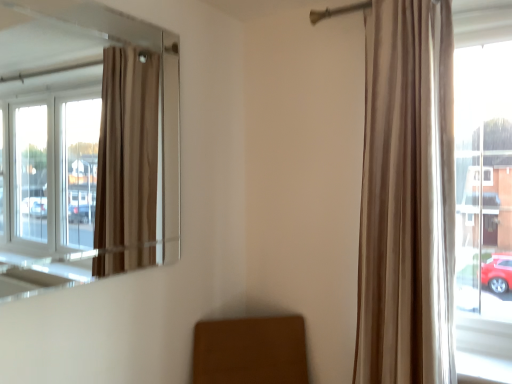
What do you see at coordinates (87, 144) in the screenshot?
I see `transparent glass window at upper left` at bounding box center [87, 144].

The image size is (512, 384). I want to click on transparent glass window at upper left, so pyautogui.click(x=87, y=144).

Where is `beige velvet curtain at right`? This screenshot has width=512, height=384. beige velvet curtain at right is located at coordinates (407, 197).

The width and height of the screenshot is (512, 384). Describe the element at coordinates (407, 197) in the screenshot. I see `beige velvet curtain at right` at that location.

The height and width of the screenshot is (384, 512). Identify the location of transparent glass window at upper left. (87, 144).

Considering the relative positions of transparent glass window at upper left and beige velvet curtain at right in the image provided, is transparent glass window at upper left to the left or to the right of beige velvet curtain at right?

transparent glass window at upper left is to the left of beige velvet curtain at right.

Which object is closer to the camera, transparent glass window at upper left or beige velvet curtain at right?

transparent glass window at upper left is in front.

Does point (12, 56) come farther from viewer compared to point (383, 273)?

Yes, it is.

From the image's perspective, would you say transparent glass window at upper left is shown under beige velvet curtain at right?

No.

From a real-world perspective, does transparent glass window at upper left stand above beige velvet curtain at right?

Yes.

In the scene shown: Which of these two, transparent glass window at upper left or beige velvet curtain at right, is thinner?

Thinner between the two is transparent glass window at upper left.

Who is taller, transparent glass window at upper left or beige velvet curtain at right?

beige velvet curtain at right is taller.

Based on the photo, can you confirm if transparent glass window at upper left is smaller than beige velvet curtain at right?

Yes, transparent glass window at upper left is smaller than beige velvet curtain at right.

Is beige velvet curtain at right surrounded by transparent glass window at upper left?

No, beige velvet curtain at right is not a part of transparent glass window at upper left.

Are transparent glass window at upper left and beige velvet curtain at right making contact?

No, transparent glass window at upper left is not beside beige velvet curtain at right.

Could you tell me if transparent glass window at upper left is facing beige velvet curtain at right?

No, transparent glass window at upper left does not turn towards beige velvet curtain at right.

How different are the orientations of transparent glass window at upper left and beige velvet curtain at right in degrees?

89.8 degrees.

Measure the distance from transparent glass window at upper left to beige velvet curtain at right.

transparent glass window at upper left and beige velvet curtain at right are 4.97 feet apart.

Where is `curtain behind the transparent glass window at upper left`? The image size is (512, 384). curtain behind the transparent glass window at upper left is located at coordinates [x=407, y=197].

Is beige velvet curtain at right to the left of transparent glass window at upper left from the viewer's perspective?

No.

Is beige velvet curtain at right in front of or behind transparent glass window at upper left in the image?

Visually, beige velvet curtain at right is located behind transparent glass window at upper left.

Is point (431, 290) closer to viewer compared to point (94, 184)?

That is True.

In the scene shown: From the image's perspective, which one is positioned lower, beige velvet curtain at right or transparent glass window at upper left?

From the image's view, beige velvet curtain at right is below.

From a real-world perspective, is beige velvet curtain at right under transparent glass window at upper left?

Yes.

Does beige velvet curtain at right have a greater width compared to transparent glass window at upper left?

Indeed, beige velvet curtain at right has a greater width compared to transparent glass window at upper left.

In the scene shown: Who is taller, beige velvet curtain at right or transparent glass window at upper left?

With more height is beige velvet curtain at right.

Who is smaller, beige velvet curtain at right or transparent glass window at upper left?

transparent glass window at upper left is smaller.

Is transparent glass window at upper left located within beige velvet curtain at right?

No, transparent glass window at upper left is not a part of beige velvet curtain at right.

Does beige velvet curtain at right touch transparent glass window at upper left?

No, beige velvet curtain at right is not next to transparent glass window at upper left.

Does beige velvet curtain at right turn towards transparent glass window at upper left?

No.

What's the angular difference between beige velvet curtain at right and transparent glass window at upper left's facing directions?

89.8 degrees separate the facing orientations of beige velvet curtain at right and transparent glass window at upper left.

Measure the distance from beige velvet curtain at right to transparent glass window at upper left.

beige velvet curtain at right is 4.97 feet from transparent glass window at upper left.

Image resolution: width=512 pixels, height=384 pixels. I want to click on window above the beige velvet curtain at right (from the image's perspective), so click(x=87, y=144).

Find the location of `window located in front of the beige velvet curtain at right`. window located in front of the beige velvet curtain at right is located at coordinates click(x=87, y=144).

What are the coordinates of `curtain behind the transparent glass window at upper left` in the screenshot? It's located at (407, 197).